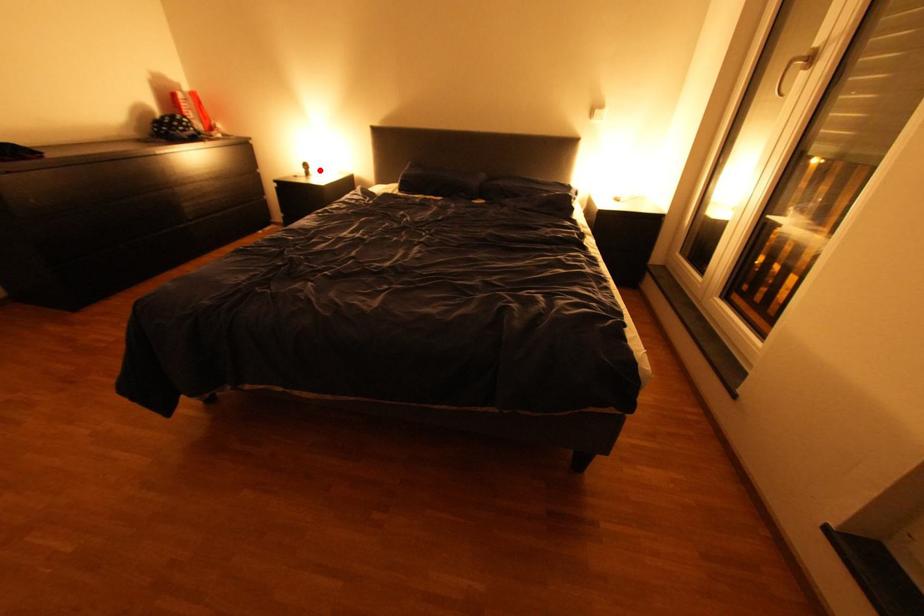
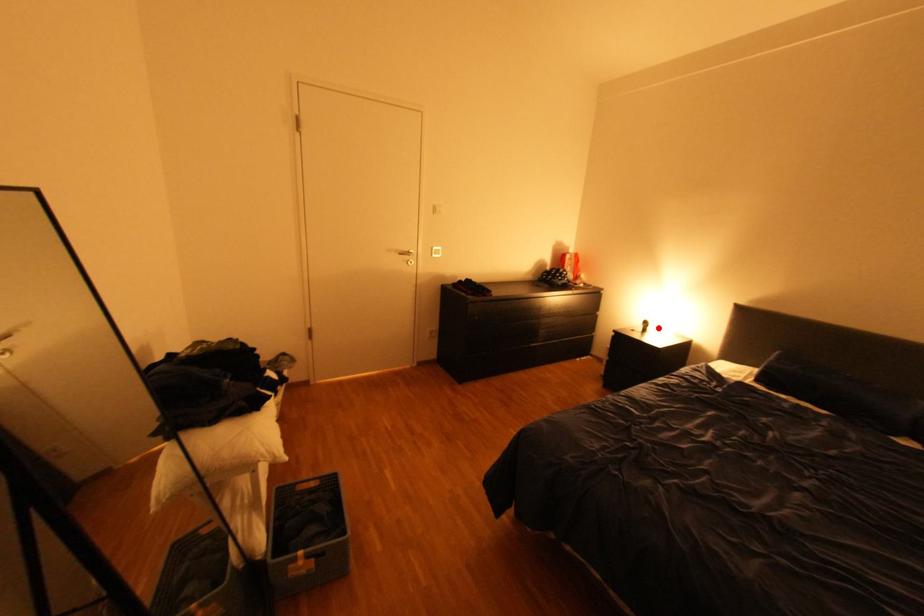
I am providing you with two images of the same scene from different viewpoints. A red point is marked on the first image and another point is marked on the second image. Are the points marked in image1 and image2 representing the same 3D position?

Yes